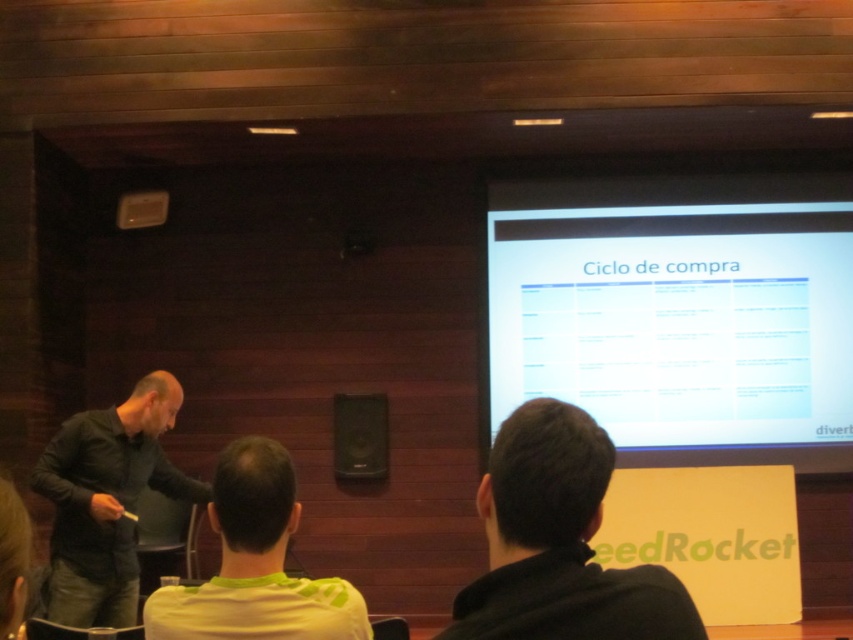
You are standing in the conference room and want to find the person wearing the black matte shirt at left. According to the scene description, where should you look?

You should look at point [107,500] to find the black matte shirt at left.

You are standing in the conference room and want to take a photo of the white glossy projection screen at upper right without including the black matte shirt at left in the frame. Is it possible to do so given their positions?

The white glossy projection screen at upper right is further to the viewer than the black matte shirt at left, so yes, you can position yourself to capture the white glossy projection screen at upper right while excluding the black matte shirt at left from the frame.

You are a speaker preparing to give a presentation in the conference room. You notice the white glossy projection screen at upper right and the black matte shirt at left in your view. Which object would be more suitable for projecting your slides onto?

The white glossy projection screen at upper right is bigger than the black matte shirt at left, so it would be more suitable for projecting slides as it provides a larger and more appropriate surface.